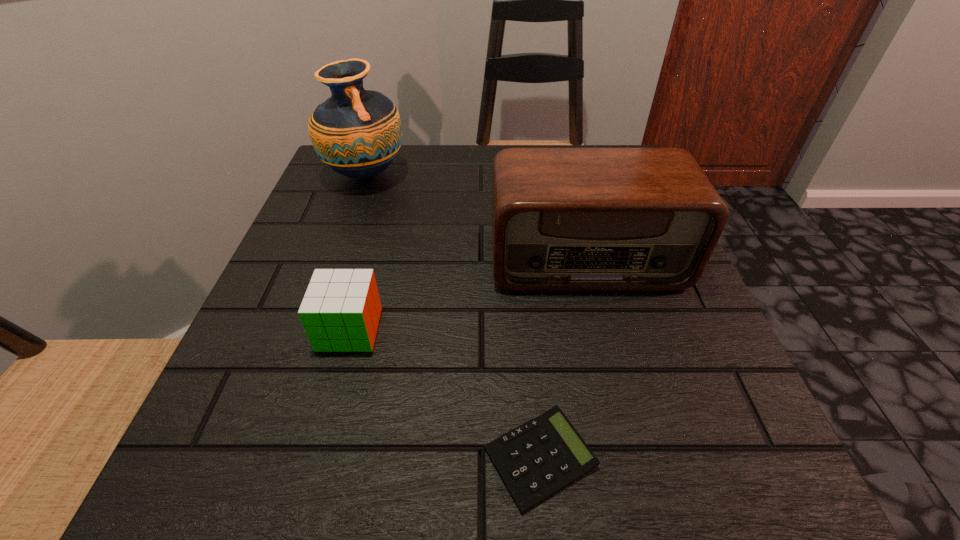
The width and height of the screenshot is (960, 540). Find the location of `vacant area at the left edge of the desktop`. vacant area at the left edge of the desktop is located at coordinates (277, 341).

Where is `free space at the right edge of the desktop`? This screenshot has height=540, width=960. free space at the right edge of the desktop is located at coordinates (646, 385).

In the image, there is a desktop. At what (x,y) coordinates should I click in order to perform the action: click on vacant region at the far left corner. Please return your answer as a coordinate pair (x, y). The width and height of the screenshot is (960, 540). Looking at the image, I should click on (382, 179).

Locate an element on the screen. free space between the calculator and the cube is located at coordinates (444, 394).

Where is `free area in between the farthest object and the radio receiver`? This screenshot has width=960, height=540. free area in between the farthest object and the radio receiver is located at coordinates click(476, 218).

I want to click on unoccupied area between the second nearest object and the nearest object, so point(444,394).

The height and width of the screenshot is (540, 960). Find the location of `unoccupied area between the radio receiver and the pottery`. unoccupied area between the radio receiver and the pottery is located at coordinates (476, 218).

Locate an element on the screen. free space between the calculator and the pottery is located at coordinates (x=453, y=316).

Where is `unoccupied position between the radio receiver and the second shortest object`? This screenshot has height=540, width=960. unoccupied position between the radio receiver and the second shortest object is located at coordinates (468, 294).

You are a GUI agent. You are given a task and a screenshot of the screen. Output one action in this format:
    pyautogui.click(x=<x>, y=<y>)
    Task: Click on the free space between the shortest object and the third shortest object
    The image size is (960, 540).
    Given the screenshot: What is the action you would take?
    pyautogui.click(x=563, y=359)